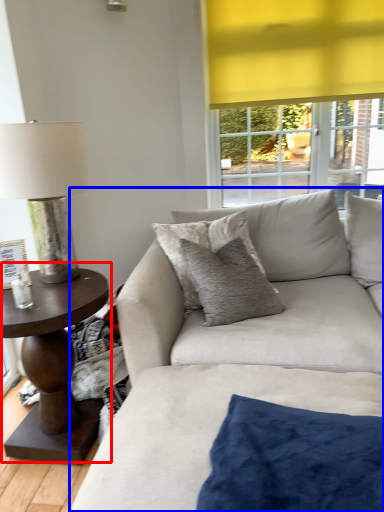
Question: Which point is further to the camera, coffee table (highlighted by a red box) or studio couch (highlighted by a blue box)?

Choices:
 (A) coffee table
 (B) studio couch

Answer: (A)